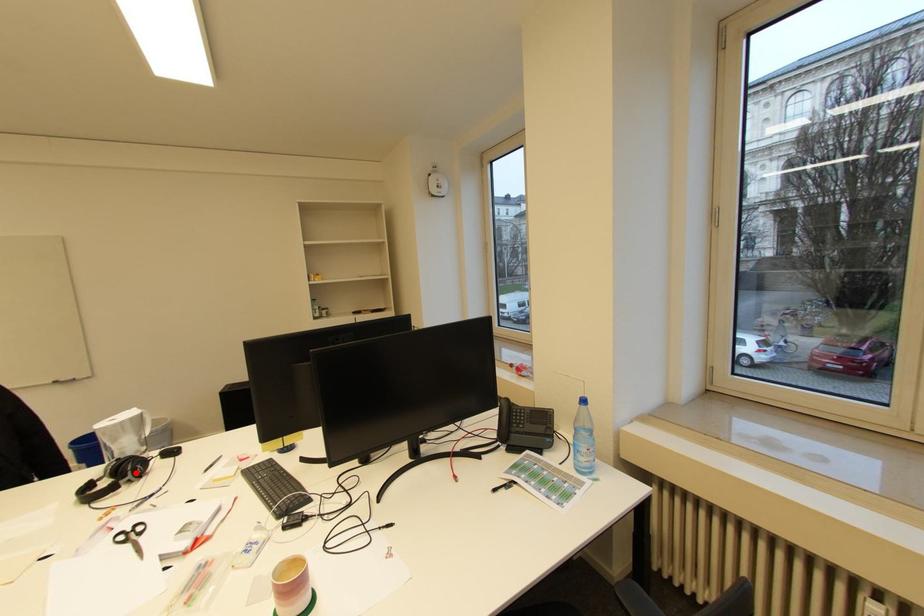
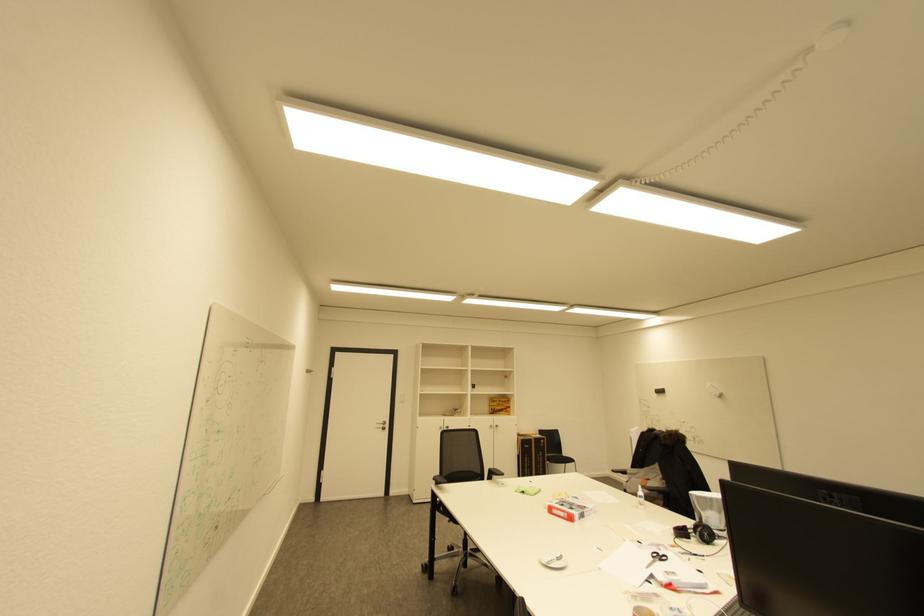
The point at the highlighted location is marked in the first image. Where is the corresponding point in the second image?

(704, 533)